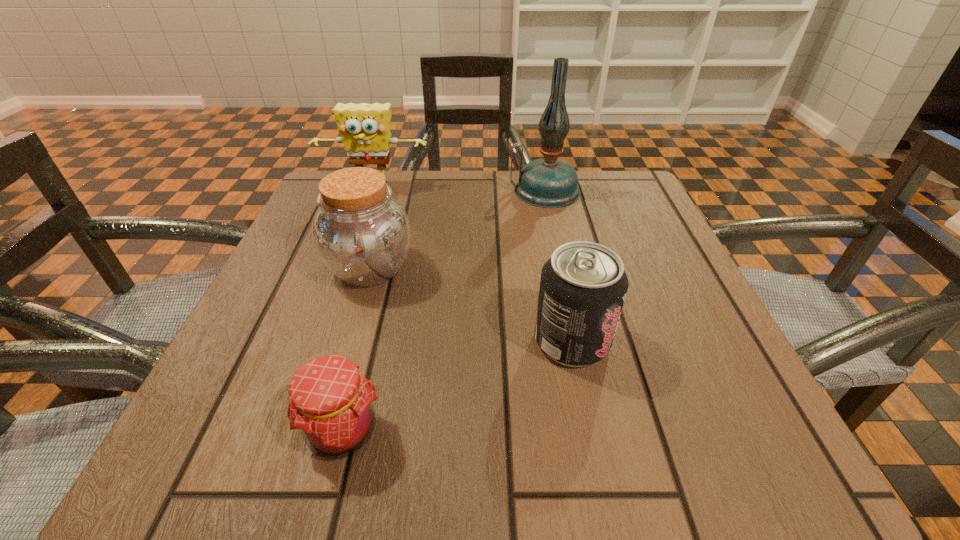
Locate an element on the screen. vacant area that satisfies the following two spatial constraints: 1. on the face of the sponge; 2. on the left side of the nearest object is located at coordinates (287, 430).

Identify the location of vacant space that satisfies the following two spatial constraints: 1. on the face of the soda can; 2. on the left side of the sponge. This screenshot has height=540, width=960. pos(319,341).

Locate an element on the screen. This screenshot has height=540, width=960. free region that satisfies the following two spatial constraints: 1. on the face of the third farthest object; 2. on the right side of the sponge is located at coordinates (345, 268).

This screenshot has height=540, width=960. In order to click on free space that satisfies the following two spatial constraints: 1. on the front side of the third farthest object; 2. on the right side of the jam in this screenshot , I will do `click(323, 430)`.